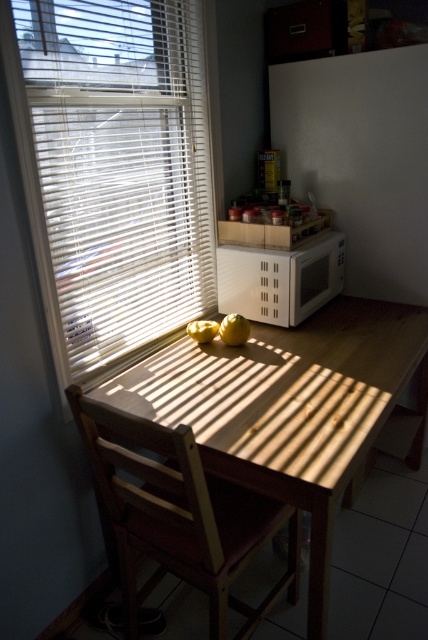
You are organizing a fruit basket and need to know which fruit takes up more space. Based on the image, which fruit has a greater width between the yellow matte pear at center and the yellow matte apple at center?

The yellow matte pear at center has a greater width than the yellow matte apple at center.

You are arranging a fruit basket and need to place the yellow matte pear at center. The white plastic blinds at upper left are in the way. Can you move the pear to the right side of the table without moving the blinds?

The white plastic blinds at upper left is above the yellow matte pear at center, so moving the pear to the right side of the table won